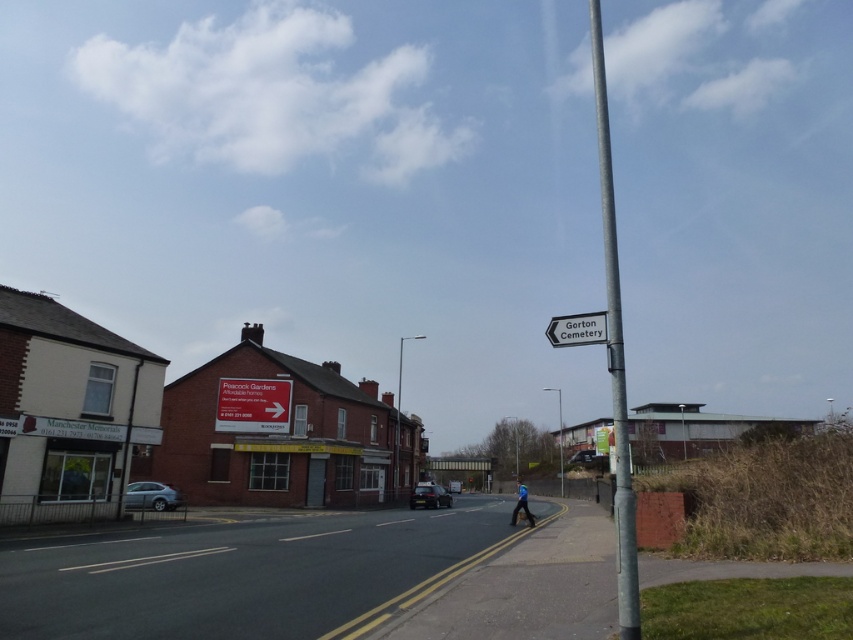
You are a delivery person trying to navigate through the street scene. You need to place a new sign that is 1.2 meters wide between the silver metallic pole at right and the white plastic sign at upper center. Based on their widths, will the new sign fit between them without overlapping?

The silver metallic pole at right is wider than the white plastic sign at upper center. However, since the exact widths are not provided, we cannot determine if the 1.2 meter wide sign will fit between them without overlapping. Additional measurements are needed.

You are a delivery person trying to navigate through the street scene. You need to place a large package next to the silver metallic pole at right without blocking the blue fabric person at lower center. Given their sizes, is this possible?

The silver metallic pole at right is larger than the blue fabric person at lower center, so placing the package next to the pole while avoiding the person should be feasible as there is enough space around the larger pole.

You are standing at the edge of the road and want to reach the silver metallic pole at right. The road has a speed limit of 30 mph. If you start walking towards the pole at a speed of 1.5 meters per second, how many seconds will it take you to reach it?

The distance between you and the silver metallic pole at right is 6.03 meters. At a walking speed of 1.5 meters per second, dividing the distance by speed gives 6.03 divided by 1.5, which equals approximately 4.02 seconds. Therefore, it will take roughly 4 seconds to reach the pole.